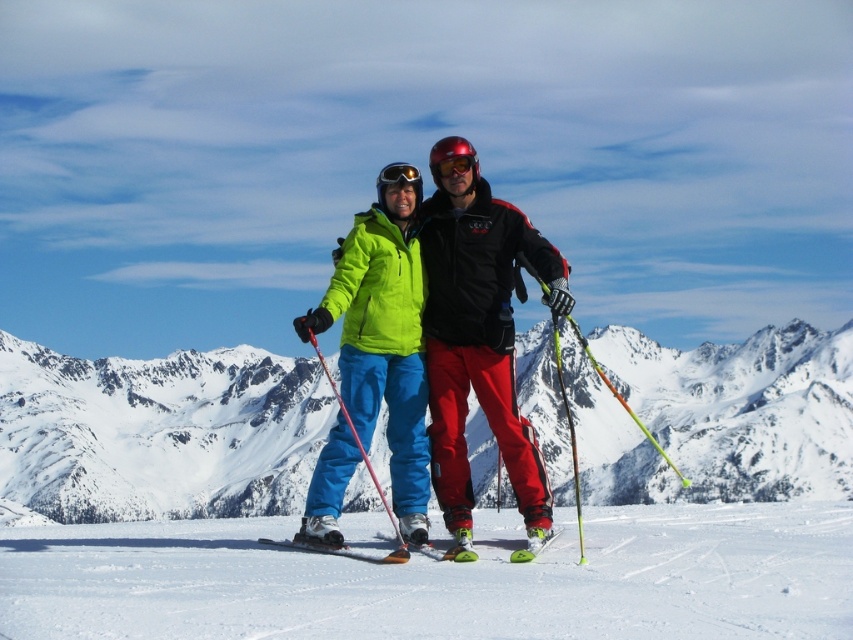
You are a photographer trying to capture a photo of the neon green jacket at center and the glossy plastic goggles at center. Based on their positions, which object should you adjust your camera focus on first if you want to ensure both are in focus?

The neon green jacket at center is to the left of glossy plastic goggles at center, so you should focus on the neon green jacket at center first to ensure both are in focus.

You are standing at the base of the mountain and want to reach the point marked at coordinates point (376, 328). If you start walking towards it, how far will you have to walk in feet?

The distance of point (376, 328) from viewer is 331.06 feet, so you will have to walk 331.06 feet to reach it.

You are a photographer trying to capture the perfect shot of the matte green jacket at center. If you want to frame the jacket precisely at the center of your camera viewfinder, which coordinates should you aim for?

You should aim for the coordinates point (480,342) to frame the matte green jacket at center precisely.